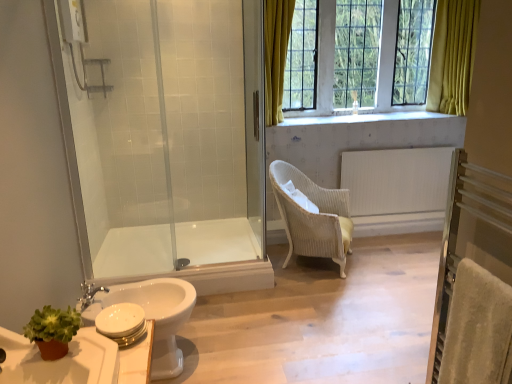
Question: From their relative heights in the image, would you say white glossy toilet at lower left is taller or shorter than beige wicker chair at center?

Choices:
 (A) tall
 (B) short

Answer: (B)

Question: From a real-world perspective, is white glossy toilet at lower left positioned above or below beige wicker chair at center?

Choices:
 (A) above
 (B) below

Answer: (B)

Question: Based on their relative distances, which object is farther from the white glossy bathtub at center?

Choices:
 (A) white glossy toilet at lower left
 (B) clear glass shower door at center
 (C) transparent glass shower door at left
 (D) translucent glass vase at upper center
 (E) white glossy sink at lower left

Answer: (D)

Question: Which is farther from the beige velvety towel at lower right?

Choices:
 (A) white glossy toilet at lower left
 (B) white textured radiator at center right
 (C) transparent glass shower door at left
 (D) white glossy sink at lower left
 (E) translucent glass vase at upper center

Answer: (E)